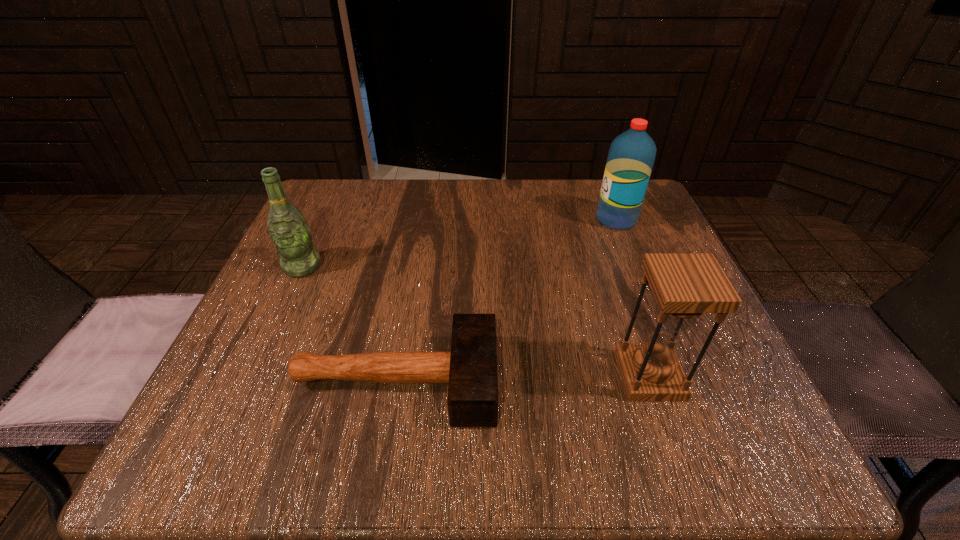
I want to click on the farthest object, so click(x=631, y=156).

The height and width of the screenshot is (540, 960). Identify the location of beer bottle. pyautogui.click(x=288, y=229).

Find the location of `the leftmost object`. the leftmost object is located at coordinates (288, 229).

Locate an element on the screen. The image size is (960, 540). hourglass is located at coordinates (685, 285).

Locate an element on the screen. Image resolution: width=960 pixels, height=540 pixels. the shortest object is located at coordinates (470, 368).

This screenshot has width=960, height=540. Find the location of `mallet`. mallet is located at coordinates (470, 368).

Locate an element on the screen. This screenshot has width=960, height=540. blank space located 0.260m on the front label of the farthest object is located at coordinates (484, 220).

Find the location of a particular element. The height and width of the screenshot is (540, 960). vacant space located on the front label of the farthest object is located at coordinates (442, 220).

Locate an element on the screen. Image resolution: width=960 pixels, height=540 pixels. blank space located 0.350m on the front label of the farthest object is located at coordinates (445, 220).

I want to click on vacant position located 0.080m on the surface of the leftmost object, so click(283, 308).